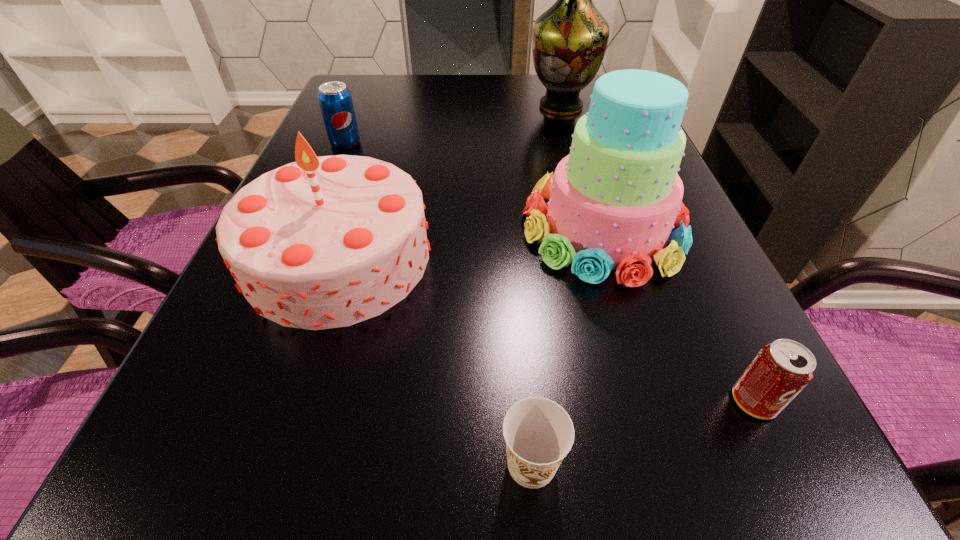
Where is `the tallest object`? This screenshot has height=540, width=960. the tallest object is located at coordinates (569, 40).

Identify the location of the farthest object. This screenshot has height=540, width=960. (569, 40).

Locate an element on the screen. This screenshot has width=960, height=540. cake is located at coordinates (614, 200).

I want to click on birthday cake, so (x=324, y=242).

Locate an element on the screen. The image size is (960, 540). the farther soda can is located at coordinates (335, 100).

Find the location of a particular element. The image size is (960, 540). the second farthest object is located at coordinates (335, 100).

The image size is (960, 540). What are the coordinates of `the right soda can` in the screenshot? It's located at (781, 370).

At what (x,y) coordinates should I click in order to perform the action: click on the nearer soda can. Please return your answer as a coordinate pair (x, y). This screenshot has height=540, width=960. Looking at the image, I should click on (781, 370).

At what (x,y) coordinates should I click in order to perform the action: click on Dixie cup. Please return your answer as a coordinate pair (x, y). Looking at the image, I should click on (539, 433).

Where is `the shortest object`? This screenshot has width=960, height=540. the shortest object is located at coordinates (539, 433).